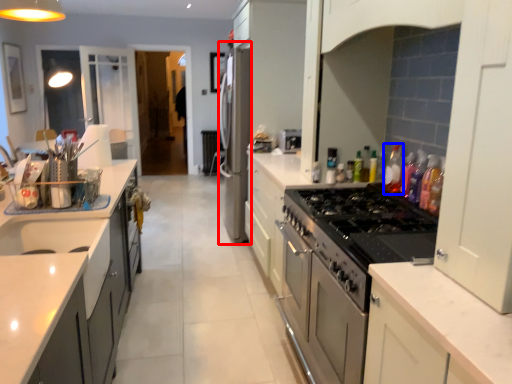
Question: Which object is further to the camera taking this photo, appliance (highlighted by a red box) or bottle (highlighted by a blue box)?

Choices:
 (A) appliance
 (B) bottle

Answer: (A)